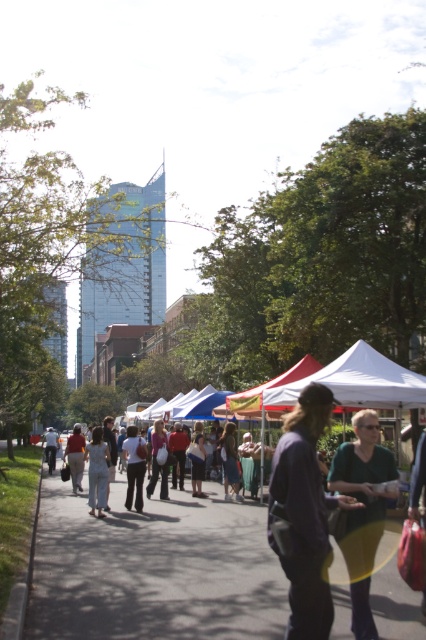
Is light blue denim dress at center positioned before light gray pants at center?

Yes.

Between point (101, 468) and point (132, 454), which one is positioned behind?

The point (132, 454) is behind.

Identify the location of light blue denim dress at center. The width and height of the screenshot is (426, 640). (97, 472).

Is green fabric bag at center further to camera compared to light gray pants at center?

No, it is not.

Is point (356, 428) more distant than point (138, 468)?

No.

The image size is (426, 640). Describe the element at coordinates (362, 509) in the screenshot. I see `green fabric bag at center` at that location.

Find the location of a particular element. This screenshot has height=640, width=426. green fabric bag at center is located at coordinates (362, 509).

Is dark purple shirt at center smaller than light gray pants at center?

No, dark purple shirt at center is not smaller than light gray pants at center.

The image size is (426, 640). In order to click on dark purple shirt at center in this screenshot , I will do `click(305, 513)`.

Between point (304, 602) and point (132, 484), which one is positioned behind?

Positioned behind is point (132, 484).

You are a GUI agent. You are given a task and a screenshot of the screen. Output one action in this format:
    pyautogui.click(x=<x>, y=<y>)
    Task: Click on the dark purple shirt at center
    
    Given the screenshot: What is the action you would take?
    pyautogui.click(x=305, y=513)